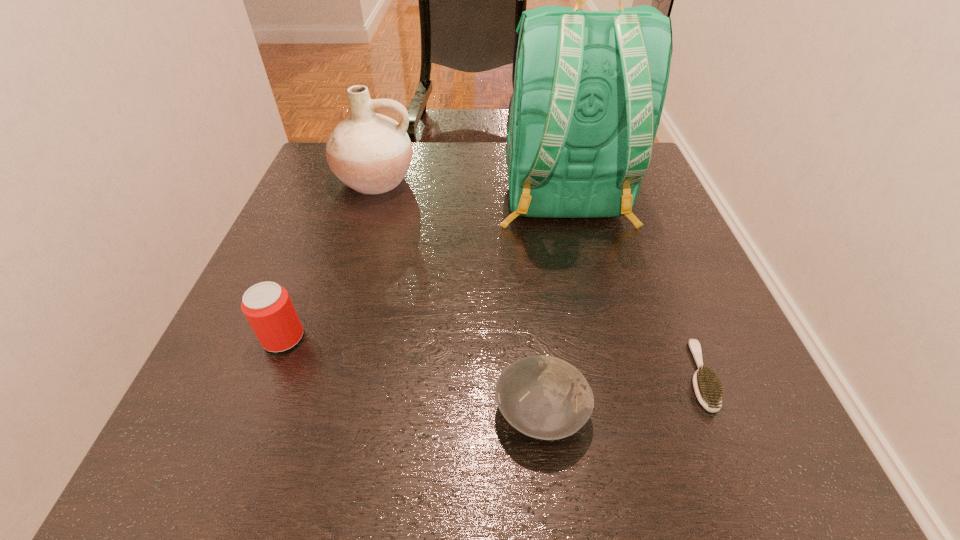
I want to click on free point between the third tallest object and the second tallest object, so click(329, 259).

Where is `free point between the backpack and the fourth tallest object`? This screenshot has height=540, width=960. free point between the backpack and the fourth tallest object is located at coordinates click(x=553, y=306).

The width and height of the screenshot is (960, 540). What are the coordinates of `free space that is in between the tallest object and the bowl` in the screenshot? It's located at (553, 306).

Locate which object ranks fourth in proximity to the pottery. Please provide its 2D coordinates. Your answer should be formatted as a tuple, i.e. [(x, y)], where the tuple contains the x and y coordinates of a point satisfying the conditions above.

[(708, 389)]

This screenshot has width=960, height=540. Find the location of `the second closest object relative to the backpack`. the second closest object relative to the backpack is located at coordinates (708, 389).

Find the location of a particular element. This screenshot has width=960, height=540. blank area in the image that satisfies the following two spatial constraints: 1. to pour from the handle of the scrubbing brush; 2. on the left side of the pottery is located at coordinates (315, 375).

Where is `free point that satisfies the following two spatial constraints: 1. on the front side of the bowl; 2. on the right side of the beer can`? free point that satisfies the following two spatial constraints: 1. on the front side of the bowl; 2. on the right side of the beer can is located at coordinates pyautogui.click(x=254, y=411).

Where is `free space that satisfies the following two spatial constraints: 1. on the back side of the shortest object; 2. on the right side of the second shortest object`? The height and width of the screenshot is (540, 960). free space that satisfies the following two spatial constraints: 1. on the back side of the shortest object; 2. on the right side of the second shortest object is located at coordinates (538, 375).

Image resolution: width=960 pixels, height=540 pixels. I want to click on free space that satisfies the following two spatial constraints: 1. on the back of the shortest object; 2. on the left side of the tallest object, so click(x=605, y=375).

The height and width of the screenshot is (540, 960). Find the location of `vacant space that satisfies the following two spatial constraints: 1. to pour from the handle of the pottery; 2. on the left side of the shortest object`. vacant space that satisfies the following two spatial constraints: 1. to pour from the handle of the pottery; 2. on the left side of the shortest object is located at coordinates (315, 375).